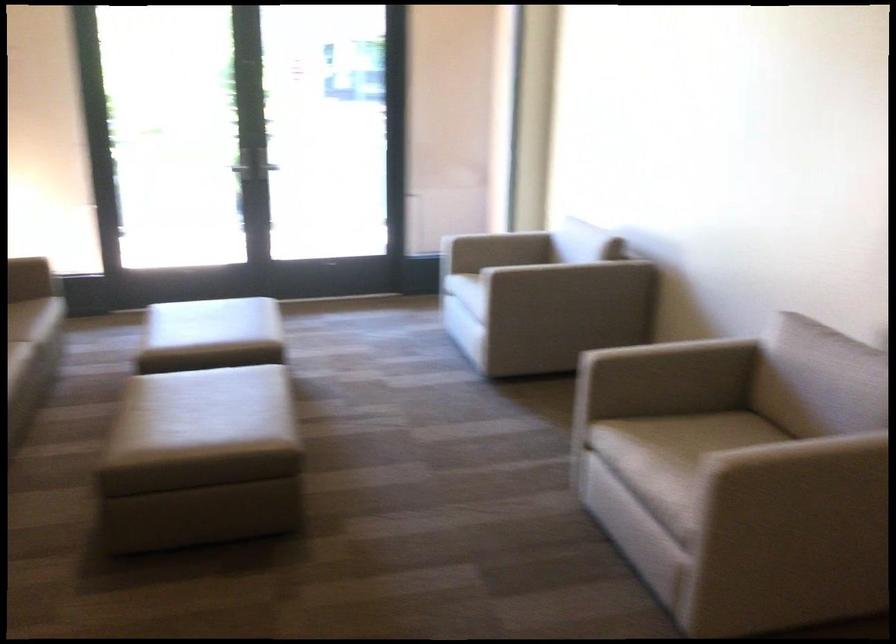
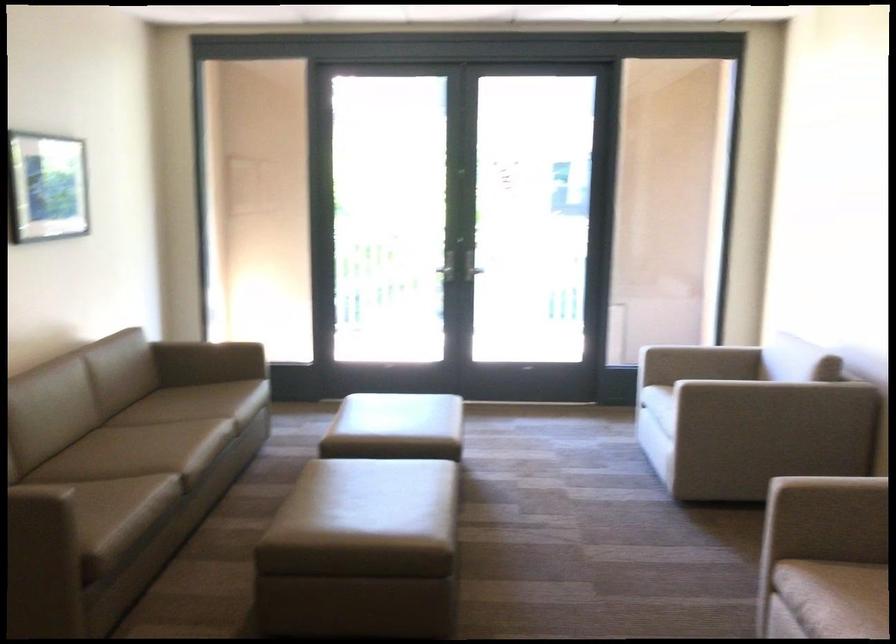
The point at (524, 242) is marked in the first image. Where is the corresponding point in the second image?

(734, 363)